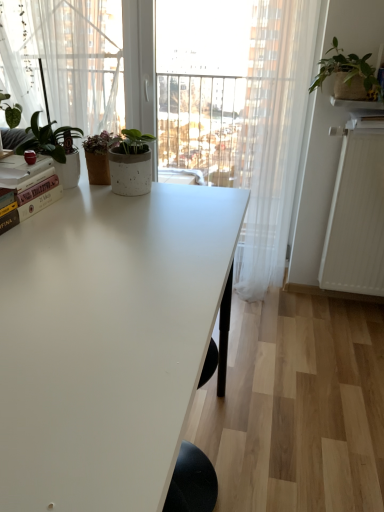
This screenshot has width=384, height=512. Identify the location of white ceramic shelf at upper right. (359, 105).

Locate an element on the screen. This screenshot has height=512, width=384. white matte table at center is located at coordinates (109, 341).

What do you see at coordinates (266, 138) in the screenshot? This screenshot has height=512, width=384. I see `white sheer curtain at right` at bounding box center [266, 138].

Find the location of a particular element. The height and width of the screenshot is (512, 384). white ceramic shelf at upper right is located at coordinates (359, 105).

How much distance is there between white textured radiator at right and matte white pot at upper left, which is the 1th houseplant from left to right?

A distance of 1.49 meters exists between white textured radiator at right and matte white pot at upper left, which is the 1th houseplant from left to right.

This screenshot has height=512, width=384. What are the coordinates of `radiator behind the matte white pot at upper left, which is the first houseplant in front-to-back order` in the screenshot? It's located at (357, 215).

Does point (358, 162) come in front of point (32, 132)?

That is False.

Looking at this image, can you confirm if white textured radiator at right is smaller than matte white pot at upper left, the 2th houseplant positioned from the back?

Actually, white textured radiator at right might be larger than matte white pot at upper left, the 2th houseplant positioned from the back.

Between matte white pot at upper left, arranged as the 2th houseplant when viewed from the right, and burlap-textured plant at upper right, the first houseplant in the top-to-bottom sequence, which one has more height?

matte white pot at upper left, arranged as the 2th houseplant when viewed from the right.

From a real-world perspective, is matte white pot at upper left, which is the 1th houseplant from left to right, positioned over burlap-textured plant at upper right, which is the 1th houseplant in right-to-left order, based on gravity?

No, from a real-world perspective, matte white pot at upper left, which is the 1th houseplant from left to right, is not over burlap-textured plant at upper right, which is the 1th houseplant in right-to-left order

Between matte white pot at upper left, which is the first houseplant in front-to-back order, and burlap-textured plant at upper right, the 1th houseplant from the back, which one has smaller size?

With smaller size is matte white pot at upper left, which is the first houseplant in front-to-back order.

Which is less distant, (17,181) or (316,77)?

Positioned in front is point (17,181).

Could you tell me if hardcover book at left is facing white sheer curtain at right?

No, hardcover book at left does not turn towards white sheer curtain at right.

Who is taller, hardcover book at left or white sheer curtain at right?

white sheer curtain at right is taller.

Is hardcover book at left touching white sheer curtain at right?

hardcover book at left is not next to white sheer curtain at right, and they're not touching.

From a real-world perspective, between hardcover book at left and white sheer curtain at right, who is vertically lower?

white sheer curtain at right is physically lower.

Is burlap-textured plant at upper right, the first houseplant in the top-to-bottom sequence, a part of white ceramic shelf at upper right?

Definitely not — burlap-textured plant at upper right, the first houseplant in the top-to-bottom sequence, is not inside white ceramic shelf at upper right.

Which of these two, white ceramic shelf at upper right or burlap-textured plant at upper right, which is the 1th houseplant in right-to-left order, is bigger?

With larger size is burlap-textured plant at upper right, which is the 1th houseplant in right-to-left order.

Considering the relative sizes of white ceramic shelf at upper right and burlap-textured plant at upper right, the 1th houseplant from the back, in the image provided, is white ceramic shelf at upper right wider than burlap-textured plant at upper right, the 1th houseplant from the back,?

No, white ceramic shelf at upper right is not wider than burlap-textured plant at upper right, the 1th houseplant from the back.

Considering the positions of objects white ceramic shelf at upper right and burlap-textured plant at upper right, which is the second houseplant in bottom-to-top order, in the image provided, who is more to the left, white ceramic shelf at upper right or burlap-textured plant at upper right, which is the second houseplant in bottom-to-top order,?

burlap-textured plant at upper right, which is the second houseplant in bottom-to-top order.

Does hardcover book at left have a lesser width compared to white matte table at center?

Yes, hardcover book at left is thinner than white matte table at center.

Is hardcover book at left bigger than white matte table at center?

No, hardcover book at left is not bigger than white matte table at center.

Find the location of a particular element. The width and height of the screenshot is (384, 512). book behind the white matte table at center is located at coordinates (26, 188).

Is white matte table at center located within hardcover book at left?

No, white matte table at center is not a part of hardcover book at left.

Is white sheer curtain at right aimed at matte white pot at upper left, arranged as the 2th houseplant when viewed from the right?

No.

Is white sheer curtain at right far from matte white pot at upper left, marked as the first houseplant in a bottom-to-top arrangement?

white sheer curtain at right is far away from matte white pot at upper left, marked as the first houseplant in a bottom-to-top arrangement.

From the image's perspective, which one is positioned higher, white sheer curtain at right or matte white pot at upper left, which appears as the second houseplant when viewed from the top?

white sheer curtain at right appears higher in the image.

Does hardcover book at left have a smaller size compared to white ceramic shelf at upper right?

Incorrect, hardcover book at left is not smaller in size than white ceramic shelf at upper right.

From their relative heights in the image, would you say hardcover book at left is taller or shorter than white ceramic shelf at upper right?

Considering their sizes, hardcover book at left has more height than white ceramic shelf at upper right.

Is hardcover book at left in front of or behind white ceramic shelf at upper right in the image?

Clearly, hardcover book at left is in front of white ceramic shelf at upper right.

Image resolution: width=384 pixels, height=512 pixels. In order to click on the 1st houseplant positioned above the white textured radiator at right (from a real-world perspective) in this screenshot , I will do `click(37, 134)`.

The height and width of the screenshot is (512, 384). I want to click on houseplant behind the matte white pot at upper left, which appears as the second houseplant when viewed from the top, so click(x=349, y=73).

When comparing their distances from white matte table at center, does white ceramic shelf at upper right or burlap-textured plant at upper right, positioned as the second houseplant in left-to-right order, seem closer?

burlap-textured plant at upper right, positioned as the second houseplant in left-to-right order, is positioned closer to the anchor white matte table at center.

Based on their spatial positions, is white matte table at center or matte white pot at upper left, which appears as the second houseplant when viewed from the top, closer to white textured radiator at right?

Among the two, white matte table at center is located nearer to white textured radiator at right.

Considering their positions, is matte white pot at upper left, the 2th houseplant positioned from the back, positioned closer to white matte table at center than white ceramic shelf at upper right?

matte white pot at upper left, the 2th houseplant positioned from the back, lies closer to white matte table at center than the other object.

Estimate the real-world distances between objects in this image. Which object is further from burlap-textured plant at upper right, which appears as the 2th houseplant when viewed from the front, matte white pot at upper left, which is the first houseplant in front-to-back order, or hardcover book at left?

Based on the image, hardcover book at left appears to be further to burlap-textured plant at upper right, which appears as the 2th houseplant when viewed from the front.

Estimate the real-world distances between objects in this image. Which object is closer to white ceramic shelf at upper right, burlap-textured plant at upper right, the 1th houseplant from the back, or white textured radiator at right?

burlap-textured plant at upper right, the 1th houseplant from the back, is positioned closer to the anchor white ceramic shelf at upper right.

When comparing their distances from burlap-textured plant at upper right, the 1th houseplant from the back, does white ceramic shelf at upper right or hardcover book at left seem further?

Based on the image, hardcover book at left appears to be further to burlap-textured plant at upper right, the 1th houseplant from the back.

Considering their positions, is burlap-textured plant at upper right, the first houseplant in the top-to-bottom sequence, positioned further to white sheer curtain at right than matte white pot at upper left, which is the 1th houseplant from left to right?

matte white pot at upper left, which is the 1th houseplant from left to right, is positioned further to the anchor white sheer curtain at right.

Which object lies nearer to the anchor point burlap-textured plant at upper right, the first houseplant in the top-to-bottom sequence, matte white pot at upper left, which is the 1th houseplant from left to right, or white ceramic shelf at upper right?

white ceramic shelf at upper right is closer to burlap-textured plant at upper right, the first houseplant in the top-to-bottom sequence.

The width and height of the screenshot is (384, 512). I want to click on curtain between hardcover book at left and white textured radiator at right in the horizontal direction, so click(266, 138).

You are a GUI agent. You are given a task and a screenshot of the screen. Output one action in this format:
    pyautogui.click(x=<x>, y=<y>)
    Task: Click on the curtain between burlap-textured plant at upper right, which appears as the 2th houseplant when viewed from the front, and white textured radiator at right in the up-down direction
    Image resolution: width=384 pixels, height=512 pixels.
    Given the screenshot: What is the action you would take?
    pyautogui.click(x=266, y=138)

Find the location of `houseplant situated between matte white pot at upper left, which is the 1th houseplant from left to right, and white ceramic shelf at upper right from left to right`. houseplant situated between matte white pot at upper left, which is the 1th houseplant from left to right, and white ceramic shelf at upper right from left to right is located at coordinates (349, 73).

At what (x,y) coordinates should I click in order to perform the action: click on curtain located between hardcover book at left and white ceramic shelf at upper right in the left-right direction. Please return your answer as a coordinate pair (x, y). The image size is (384, 512). Looking at the image, I should click on coord(266,138).